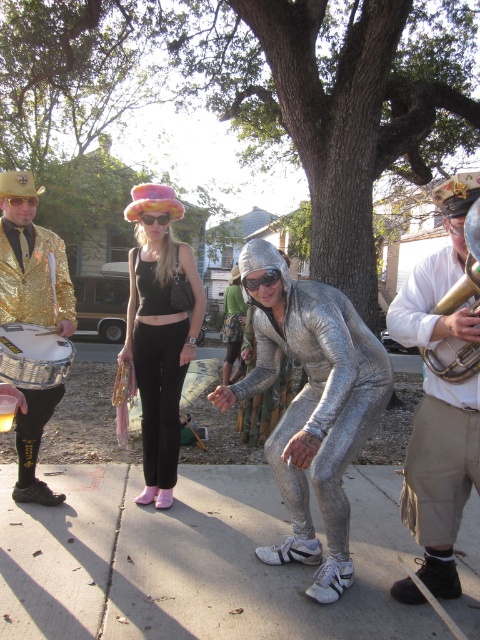
You are a photographer trying to capture a clear shot of both the gold metallic jacket at left and the gold brass trumpet at upper right. However, the trumpet is partially obstructing the jacket. Can you adjust your position to ensure both are visible without any overlap?

The gold brass trumpet at upper right is behind the gold metallic jacket at left, so moving your position slightly forward or to the side might allow you to see both without obstruction.